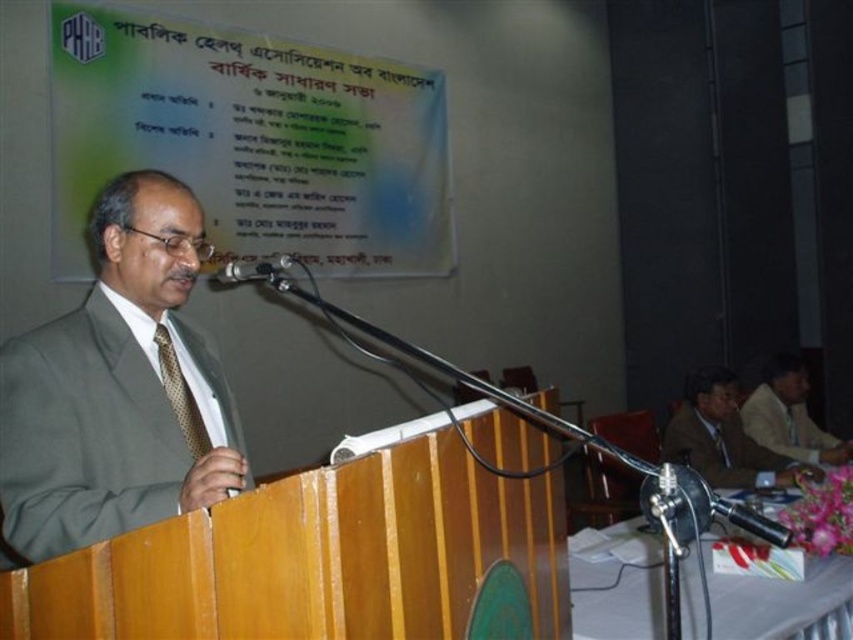
You are an event planner standing at the back of the room and need to adjust the lighting to highlight both the light brown suit at right and the gold textured tie at left. Since you can only focus on one object at a time, which one should you focus on first to ensure it is properly lit?

The light brown suit at right is closer to you than the gold textured tie at left, so you should focus on lighting the light brown suit at right first to ensure it is properly lit before adjusting for the tie.

You are organizing a formal event and need to ensure that the light brown suit at lower right and the light brown suit at right can fit side by side on a display rack. Given that the display rack has a width of 1.2 meters, can both suits fit if they are placed next to each other?

The light brown suit at lower right is wider than the light brown suit at right. Since the total width of both suits combined would exceed 1.2 meters, they cannot fit side by side on the display rack.

You are a photographer at the event and want to take a closeup shot of the emblem on the podium. The camera you are using has a focus point at coordinate point (788, 417). Will this focus point land on the emblem?

The point (788, 417) is on light brown suit at right, so the focus point will not land on the emblem on the podium. It will instead focus on the light brown suit at right.